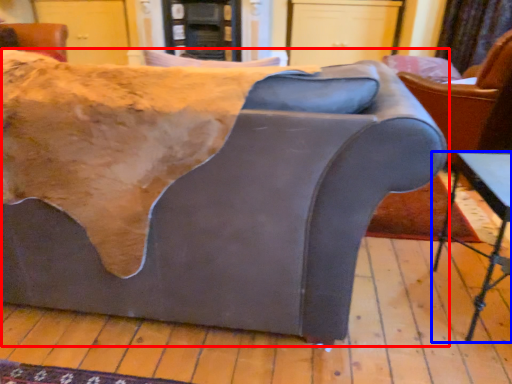
Question: Which point is further to the camera, studio couch (highlighted by a red box) or table (highlighted by a blue box)?

Choices:
 (A) studio couch
 (B) table

Answer: (B)